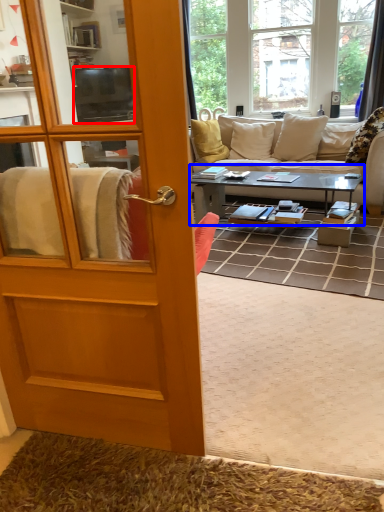
Question: Which object is further to the camera taking this photo, television (highlighted by a red box) or coffee table (highlighted by a blue box)?

Choices:
 (A) television
 (B) coffee table

Answer: (A)